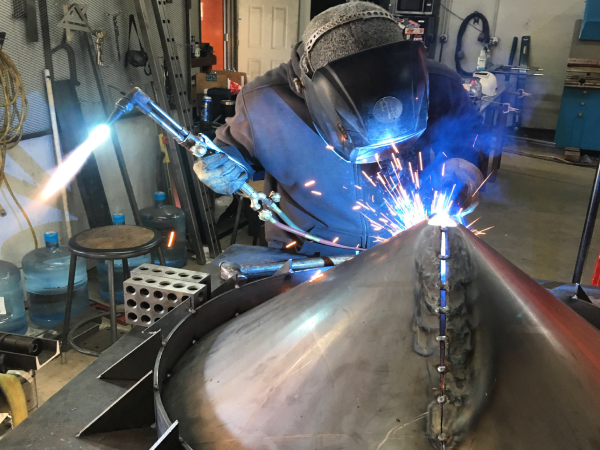
You are a GUI agent. You are given a task and a screenshot of the screen. Output one action in this format:
    pyautogui.click(x=<x>, y=<y>)
    Task: Click on the water jug
    
    Given the screenshot: What is the action you would take?
    pyautogui.click(x=176, y=235), pyautogui.click(x=118, y=263), pyautogui.click(x=58, y=272), pyautogui.click(x=10, y=290)